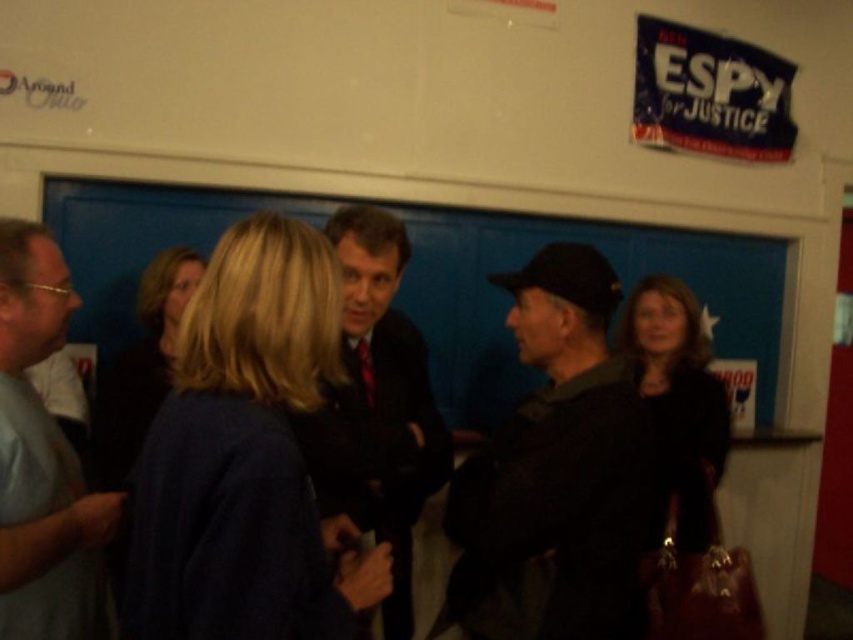
Does dark suit jacket at center have a lesser width compared to gray t-shirt at left?

No, dark suit jacket at center is not thinner than gray t-shirt at left.

Which is in front, point (354, 321) or point (16, 612)?

Positioned in front is point (16, 612).

This screenshot has height=640, width=853. I want to click on dark suit jacket at center, so click(x=376, y=404).

Who is taller, dark gray fabric jacket at center or matte black jacket at right?

dark gray fabric jacket at center

Does dark gray fabric jacket at center appear under matte black jacket at right?

No.

The width and height of the screenshot is (853, 640). Identify the location of dark gray fabric jacket at center. (556, 470).

Is the position of dark blue sweater at center less distant than that of matte black jacket at right?

Yes, dark blue sweater at center is closer to the viewer.

Is dark blue sweater at center further to camera compared to matte black jacket at right?

That is False.

Where is `dark blue sweater at center`? Image resolution: width=853 pixels, height=640 pixels. dark blue sweater at center is located at coordinates (247, 458).